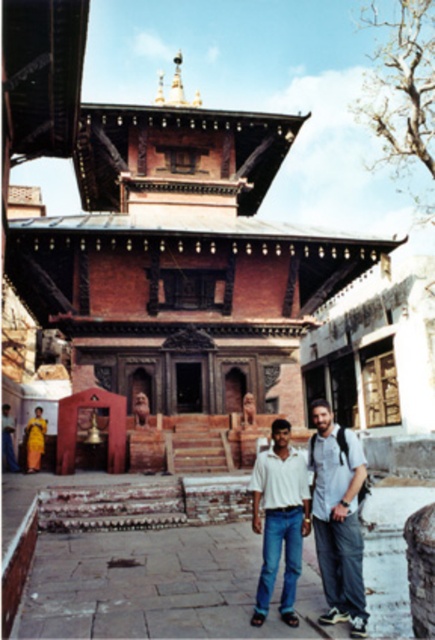
You are a photographer standing in the courtyard of the temple. You want to take a photo that includes both the white cotton shirt at center and the yellow silk sari at lower left. Given that your camera has a maximum focus range of 60 feet, will you be able to capture both subjects in focus without moving closer?

The white cotton shirt at center and the yellow silk sari at lower left are 64.98 feet apart, which exceeds the camera maximum focus range of 60 feet. Therefore, you will not be able to capture both subjects in focus without moving closer.

From the picture: You are a photographer trying to capture both the white cotton shirt at center and the white cotton shirt at lower center in a single frame. Based on their heights, which white cotton shirt should you focus on to ensure both are fully visible in the photo?

The white cotton shirt at center is not as tall as the white cotton shirt at lower center, so focusing on the taller white cotton shirt at lower center will ensure both are fully visible in the photo.